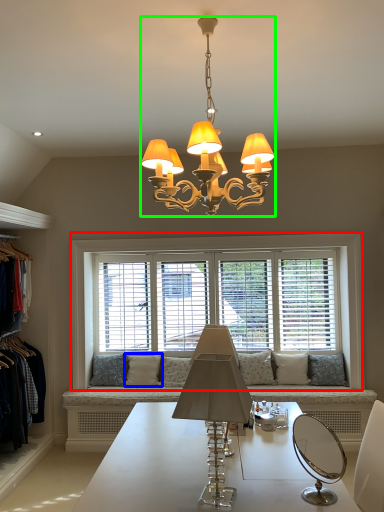
Question: Based on their relative distances, which object is farther from window (highlighted by a red box)? Choose from pillow (highlighted by a blue box) and lamp (highlighted by a green box).

Choices:
 (A) pillow
 (B) lamp

Answer: (B)